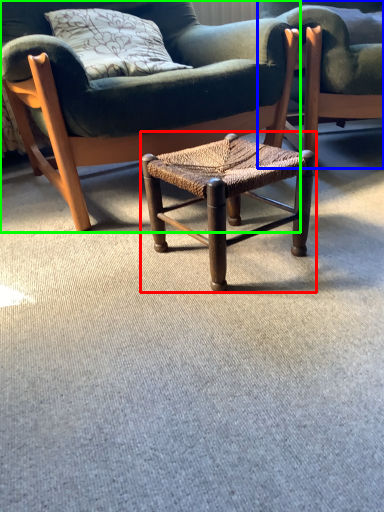
Question: Which object is positioned closest to stool (highlighted by a red box)? Select from chair (highlighted by a blue box) and chair (highlighted by a green box).

Choices:
 (A) chair
 (B) chair

Answer: (B)